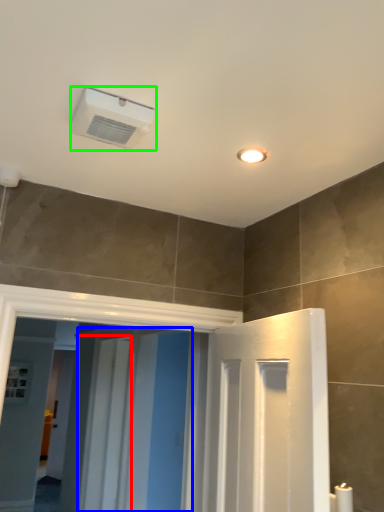
Question: Based on their relative distances, which object is farther from screen door (highlighted by a red box)? Choose from screen door (highlighted by a blue box) and air conditioning (highlighted by a green box).

Choices:
 (A) screen door
 (B) air conditioning

Answer: (B)